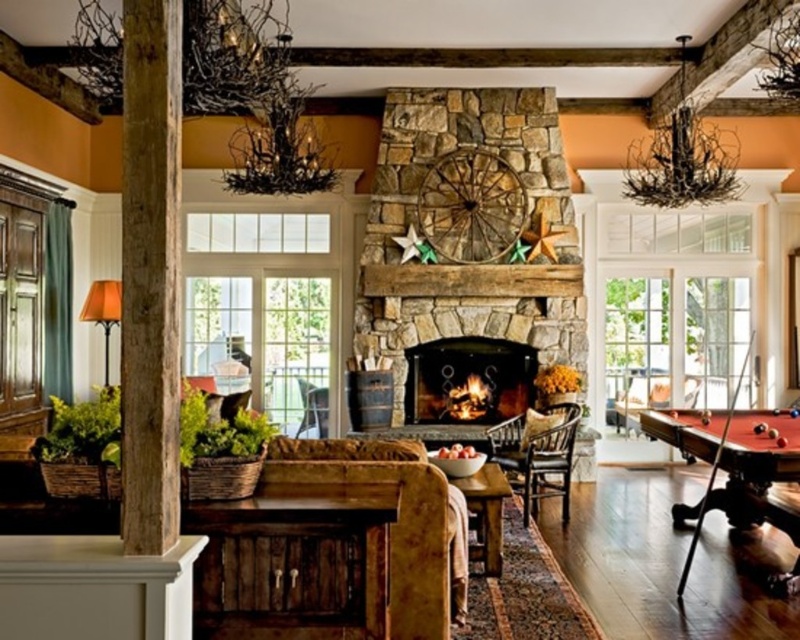
You are standing in the living room and want to place a new sofa in the corner opposite the fireplace. The current sofa is in front of the fireplace. Where is the rubberized brown pool table at lower right in relation to the new sofa location?

The rubberized brown pool table at lower right is located at point (733,464), so it is positioned to the lower right relative to the new sofa location in the corner opposite the fireplace.

Consider the image. You are sitting in the brown leather armchair at center and want to move to the dark brown wood armchair at center. Which direction should you move to reach it?

The dark brown wood armchair at center is to the right of the brown leather armchair at center, so you should move to the right to reach it.

Looking at this image, you are sitting on the brown leather armchair at center and want to reach a book on the shelf located above the dark brown wood armchair at center. Can you easily reach it from your current position?

The dark brown wood armchair at center is below the brown leather armchair at center, so the book on the shelf above the dark brown wood armchair at center is actually located below the brown leather armchair at center. Therefore, it might be difficult to reach the book from the brown leather armchair at center since it is positioned higher up.